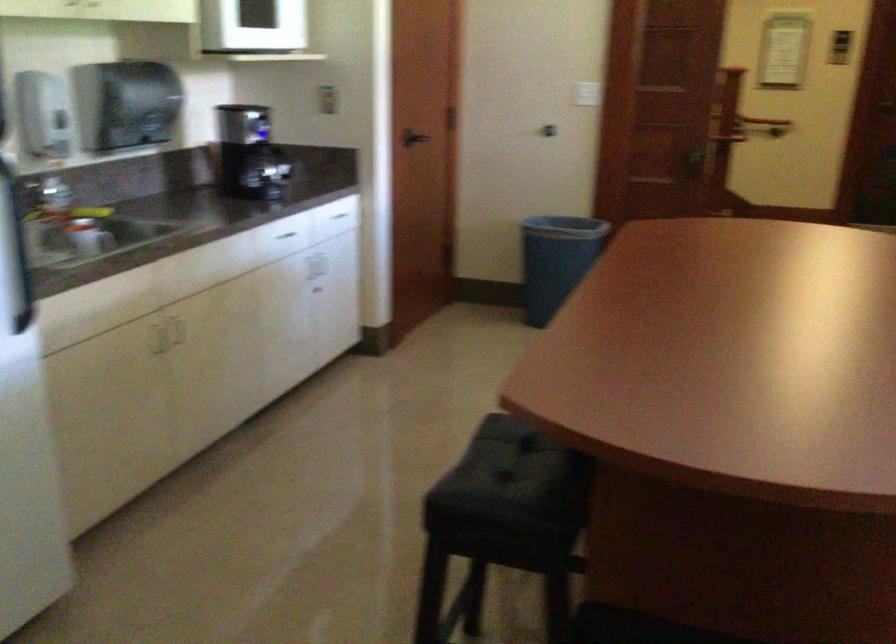
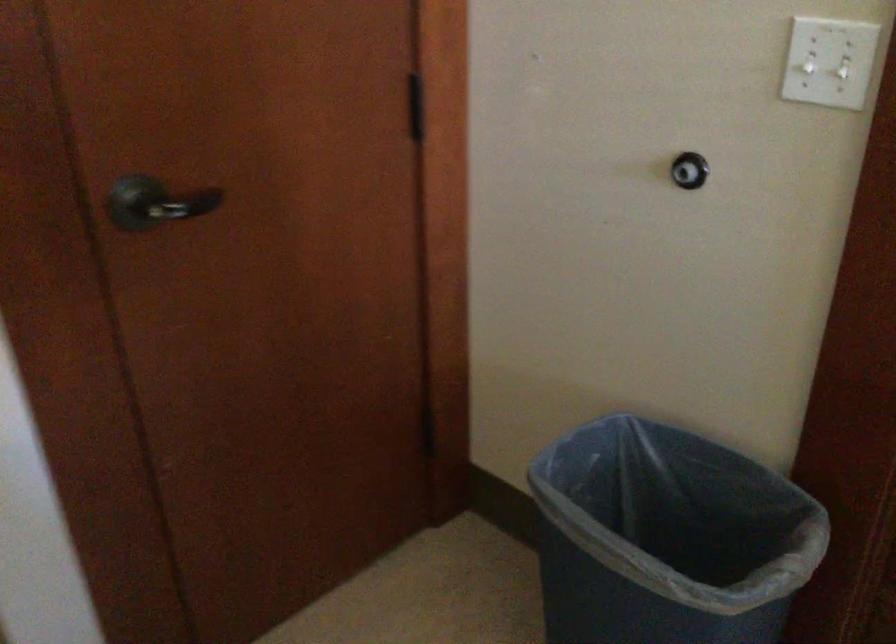
Find the pixel in the second image that matches point (609, 71) in the first image.

(842, 67)